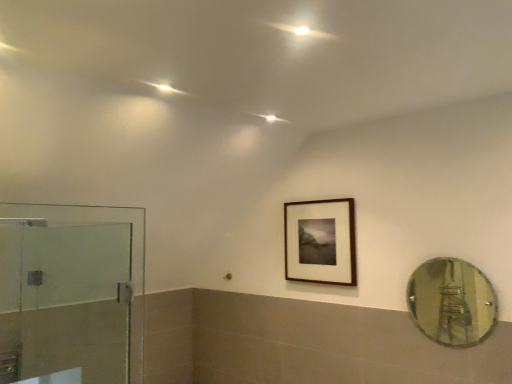
Question: Is point (322, 218) positioned closer to the camera than point (495, 319)?

Choices:
 (A) farther
 (B) closer

Answer: (A)

Question: From a real-world perspective, is wooden frame at upper center physically located above or below clear glass mirror at right?

Choices:
 (A) below
 (B) above

Answer: (B)

Question: Considering the real-world distances, which object is farthest from the transparent glass shower door at left?

Choices:
 (A) wooden frame at upper center
 (B) clear glass mirror at right

Answer: (B)

Question: Estimate the real-world distances between objects in this image. Which object is farther from the transparent glass shower door at left?

Choices:
 (A) wooden frame at upper center
 (B) clear glass mirror at right

Answer: (B)